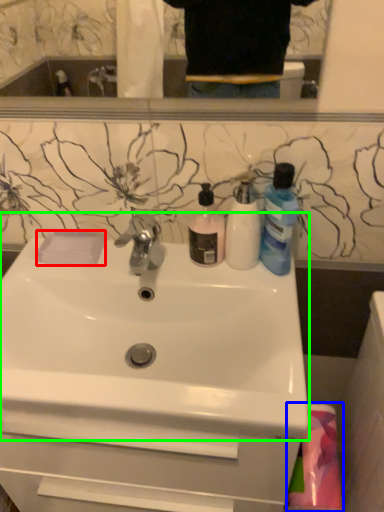
Question: Which is farther away from soap (highlighted by a red box)? material (highlighted by a blue box) or sink (highlighted by a green box)?

Choices:
 (A) material
 (B) sink

Answer: (A)